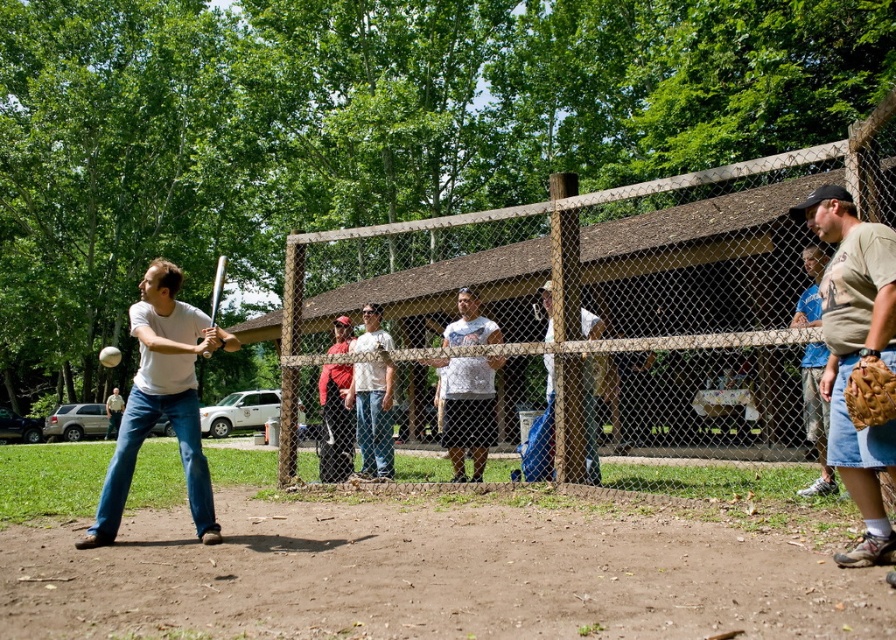
Question: Considering the real-world distances, which object is closest to the brown leather glove at right?

Choices:
 (A) red fabric cap at center
 (B) metallic silver baseball bat at left
 (C) wooden fence at center

Answer: (B)

Question: Does blue t-shirt at right have a lesser width compared to brown leather glove at right?

Choices:
 (A) yes
 (B) no

Answer: (B)

Question: Does blue t-shirt at right appear on the left side of metallic silver baseball bat at left?

Choices:
 (A) yes
 (B) no

Answer: (B)

Question: Does white matte baseball bat at center appear on the right side of blue t-shirt at right?

Choices:
 (A) no
 (B) yes

Answer: (A)

Question: Which point is closer to the camera?

Choices:
 (A) matte white shirt at center
 (B) red fabric cap at center
 (C) light brown leather glove at center
 (D) brown leather baseball glove at lower right

Answer: (D)

Question: Which of these objects is positioned closest to the metallic silver baseball bat at left?

Choices:
 (A) brown leather glove at right
 (B) white matte shirt at center

Answer: (B)